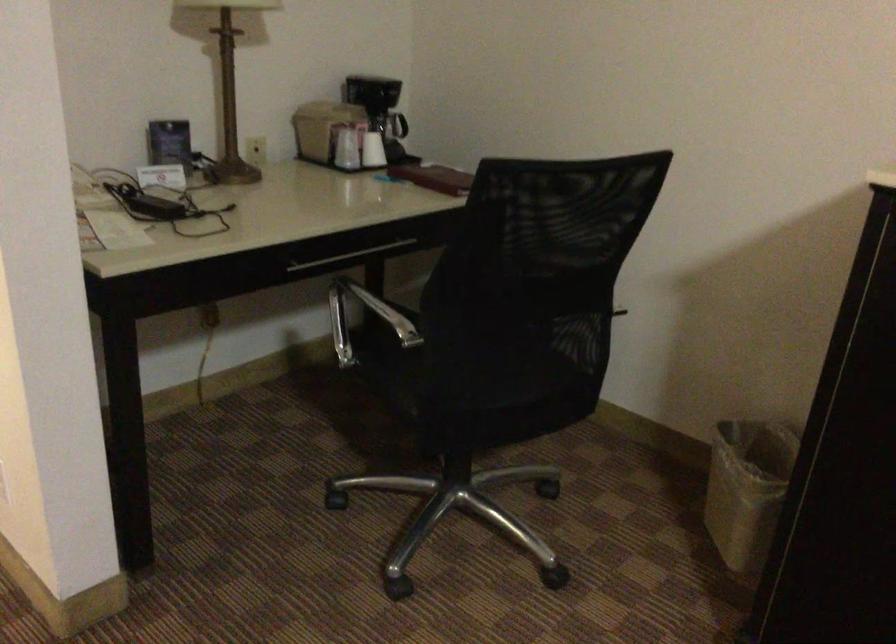
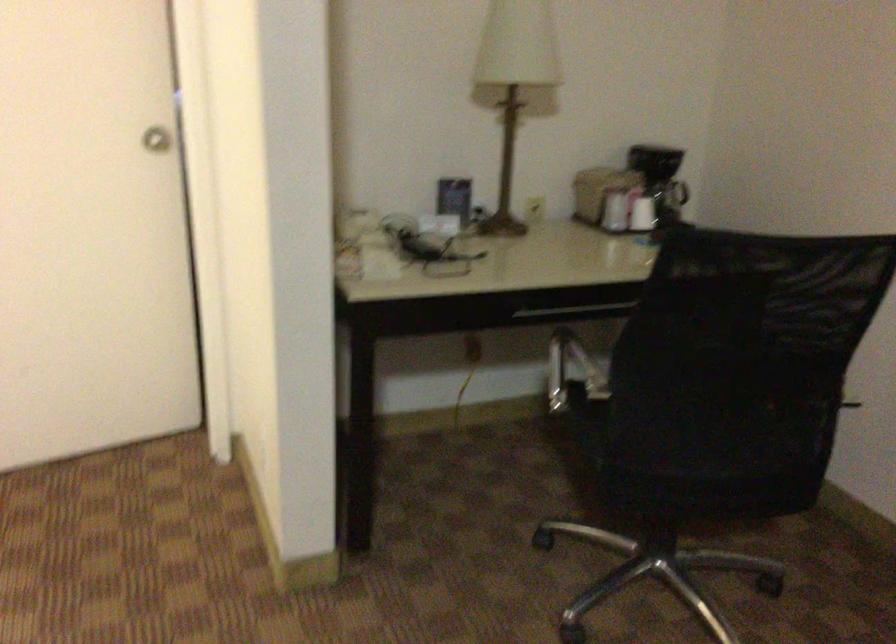
In the second image, find the point that corresponds to (x=375, y=152) in the first image.

(642, 214)